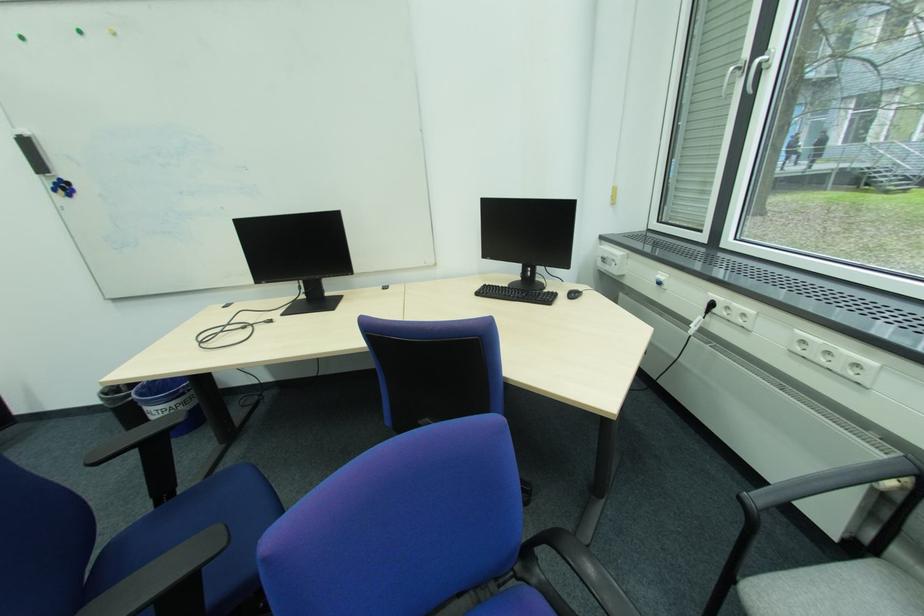
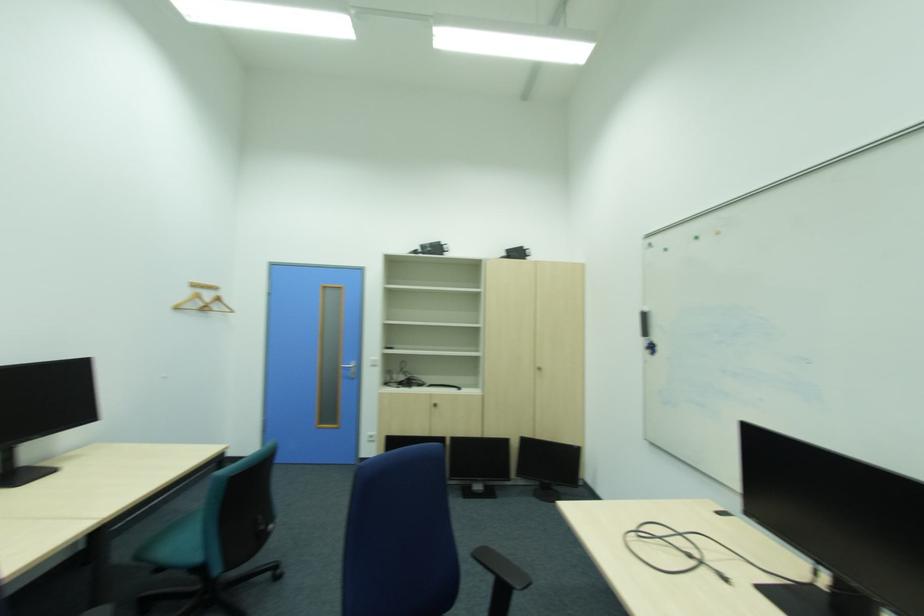
Question: I am providing you with two images of the same scene from different viewpoints. Please identify which objects are invisible in image2.

Choices:
 (A) red T-handle
 (B) black whiteboard eraser
 (C) black chair armrest
 (D) whiteboard magnet

Answer: (C)